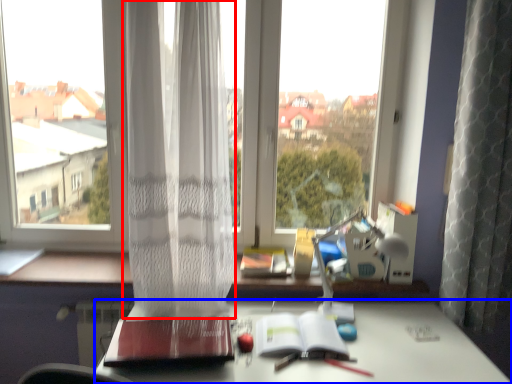
Question: Among these objects, which one is nearest to the camera, curtain (highlighted by a red box) or desk (highlighted by a blue box)?

Choices:
 (A) curtain
 (B) desk

Answer: (B)